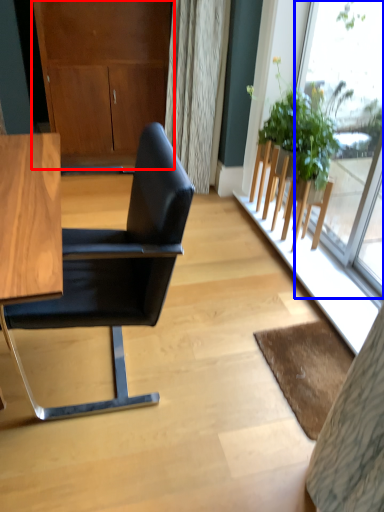
Question: Which of the following is the farthest to the observer, dresser (highlighted by a red box) or window (highlighted by a blue box)?

Choices:
 (A) dresser
 (B) window

Answer: (A)